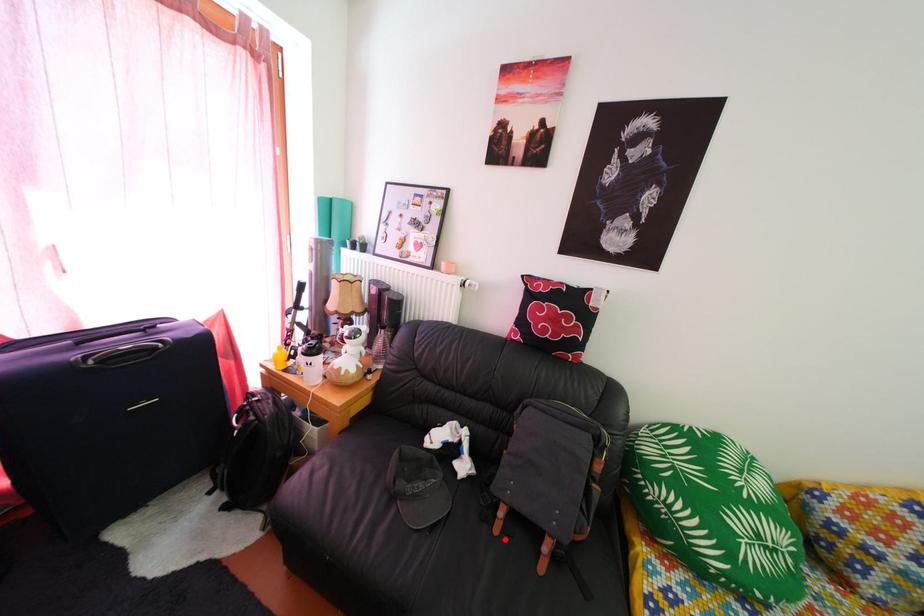
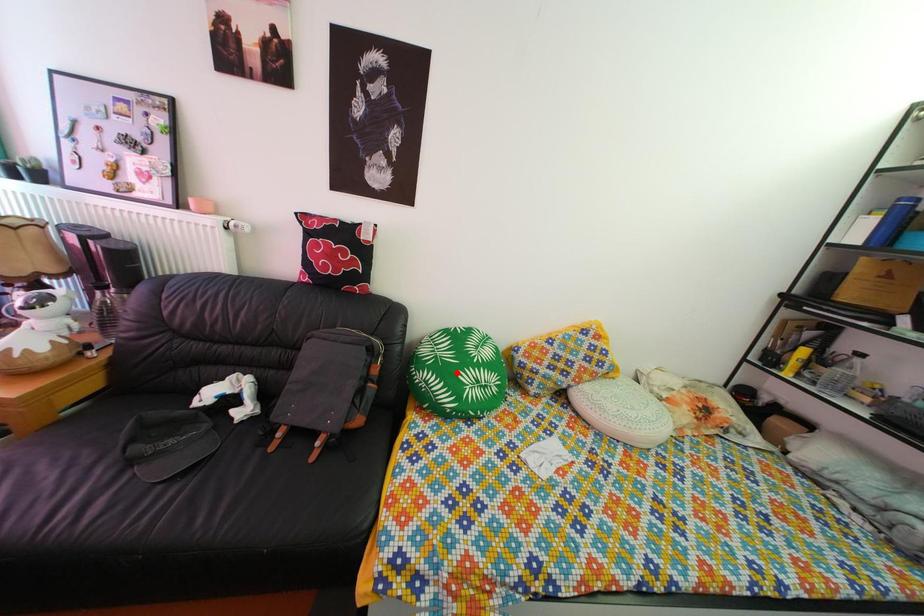
I am providing you with two images of the same scene from different viewpoints. A red point is marked on the first image and another point is marked on the second image. Does the point marked in image1 correspond to the same location as the one in image2?

No